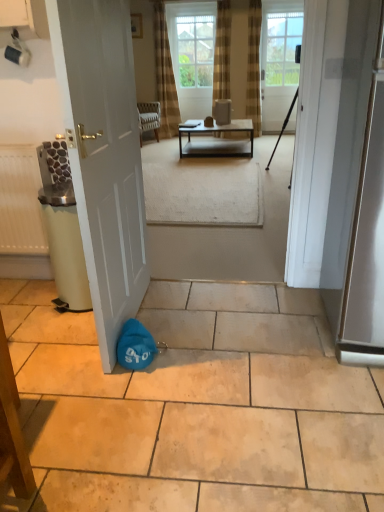
Find the location of a particular element. Image resolution: width=384 pixels, height=512 pixels. blank area beneath matte white radiator at left (from a real-world perspective) is located at coordinates (21, 282).